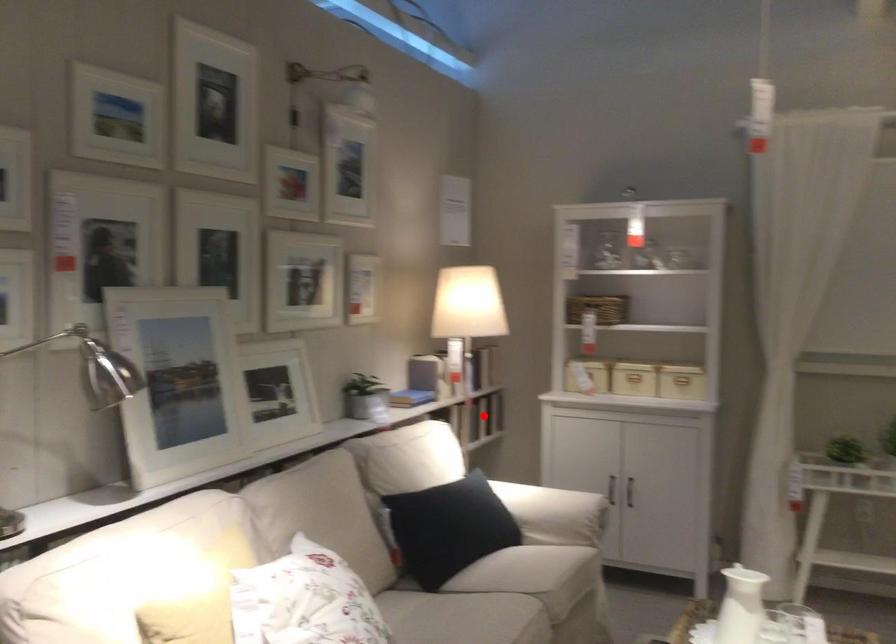
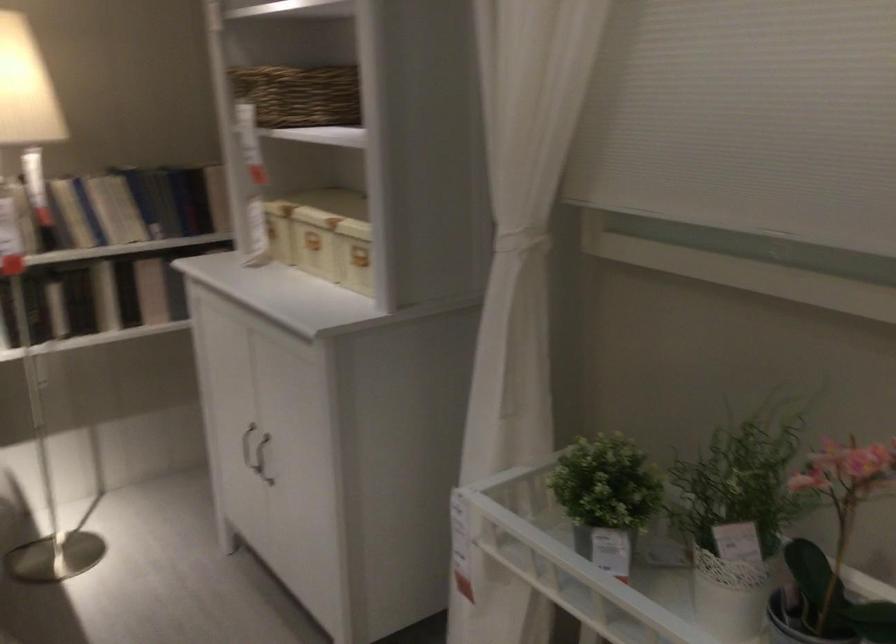
In the second image, find the point that corresponds to the highlighted location in the first image.

(151, 290)